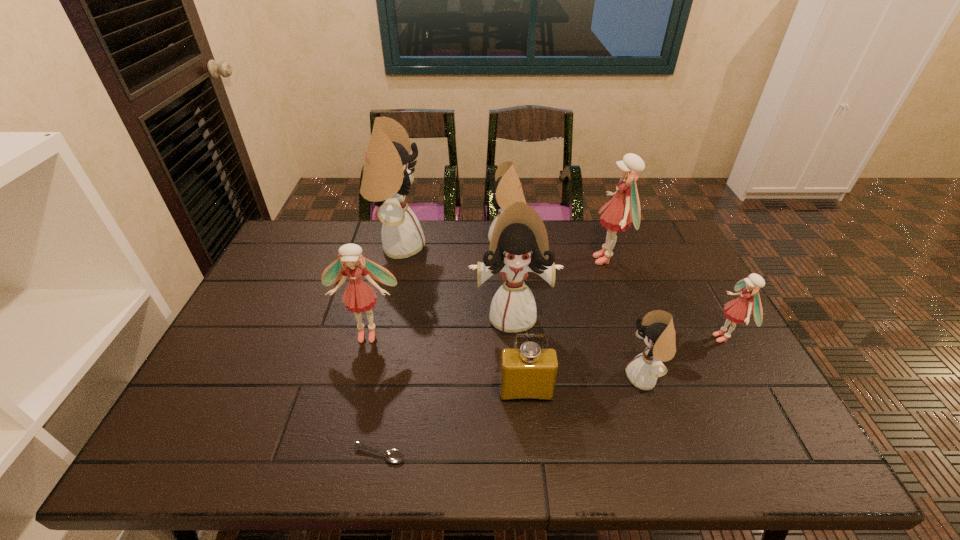
The image size is (960, 540). Find the location of `free space located 0.060m at the front face of the second smallest black doll`. free space located 0.060m at the front face of the second smallest black doll is located at coordinates (471, 242).

I want to click on vacant area located at the front face of the second smallest black doll, so click(x=388, y=242).

Image resolution: width=960 pixels, height=540 pixels. I want to click on vacant space located 0.290m on the front-facing side of the leftmost pink doll, so click(340, 447).

Where is `vacant space located 0.300m on the front-facing side of the rightmost object`? vacant space located 0.300m on the front-facing side of the rightmost object is located at coordinates (602, 338).

Where is `blank space located 0.270m on the front-facing side of the rightmost object`? This screenshot has height=540, width=960. blank space located 0.270m on the front-facing side of the rightmost object is located at coordinates click(x=613, y=338).

This screenshot has height=540, width=960. In order to click on vacant space positioned on the front-facing side of the rightmost object in this screenshot , I will do `click(595, 338)`.

This screenshot has width=960, height=540. Identify the location of vacant space located at the front face of the rightmost black doll. (546, 378).

Where is `vacant region located 0.270m at the front face of the rightmost black doll`? The image size is (960, 540). vacant region located 0.270m at the front face of the rightmost black doll is located at coordinates (518, 378).

At what (x,y) coordinates should I click in order to perform the action: click on vacant space situated 0.220m at the front face of the rightmost black doll. Please return your answer as a coordinate pair (x, y). The image size is (960, 540). Looking at the image, I should click on (539, 378).

The image size is (960, 540). In order to click on blank space located on the front-facing side of the perfume in this screenshot , I will do `click(531, 450)`.